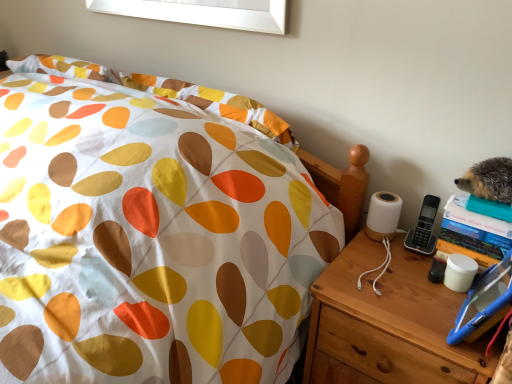
The width and height of the screenshot is (512, 384). I want to click on vacant space situated above wooden nightstand at right (from a real-world perspective), so click(x=404, y=287).